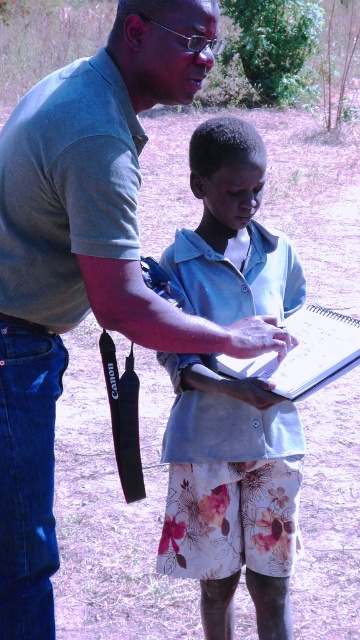
You are standing in the scene and want to place a small sticker on the object that is taller between the light blue fabric shirt at center and the white paper clipboard at center. Which object should you choose?

The light blue fabric shirt at center has a greater height compared to the white paper clipboard at center, so you should place the sticker on the light blue fabric shirt at center.

Where is the light blue fabric shirt at center located in the image?

The light blue fabric shirt at center is located at point (231,492) in the image.

You are standing in the scene and see two points marked in the image. Which point is closer to you, point (230,394) or point (261,378)?

Point (261,378) is closer to you because the description states that point (230,394) is behind point (261,378).